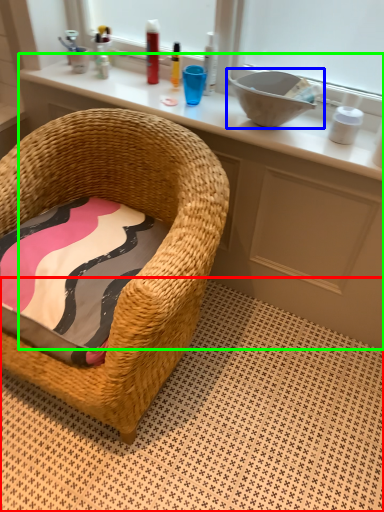
Question: Which object is the closest to the tile (highlighted by a red box)? Choose among these: sink (highlighted by a blue box) or vanity (highlighted by a green box).

Choices:
 (A) sink
 (B) vanity

Answer: (B)